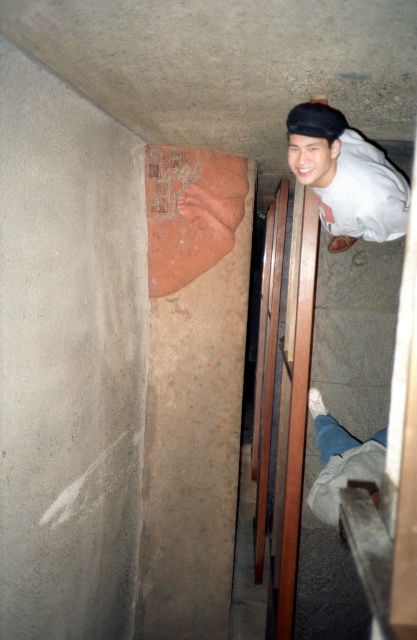
Can you confirm if white cotton pants at lower right is taller than black matte baseball hat at upper center?

Correct, white cotton pants at lower right is much taller as black matte baseball hat at upper center.

Is white cotton pants at lower right above black matte baseball hat at upper center?

Actually, white cotton pants at lower right is below black matte baseball hat at upper center.

Locate an element on the screen. This screenshot has height=640, width=417. white cotton pants at lower right is located at coordinates (341, 460).

This screenshot has height=640, width=417. Find the location of `white cotton pants at lower right`. white cotton pants at lower right is located at coordinates (341, 460).

Is white matte shirt at upper right further to the viewer compared to black matte baseball hat at upper center?

Yes, white matte shirt at upper right is further from the viewer.

Does point (356, 204) lie in front of point (316, 104)?

No, (356, 204) is further to viewer.

The width and height of the screenshot is (417, 640). I want to click on white matte shirt at upper right, so click(x=346, y=177).

Image resolution: width=417 pixels, height=640 pixels. What do you see at coordinates (346, 177) in the screenshot?
I see `white matte shirt at upper right` at bounding box center [346, 177].

Based on the photo, does white matte shirt at upper right appear under white cotton pants at lower right?

Actually, white matte shirt at upper right is above white cotton pants at lower right.

Between point (314, 157) and point (344, 467), which one is positioned behind?

Positioned behind is point (344, 467).

Image resolution: width=417 pixels, height=640 pixels. Identify the location of white matte shirt at upper right. (346, 177).